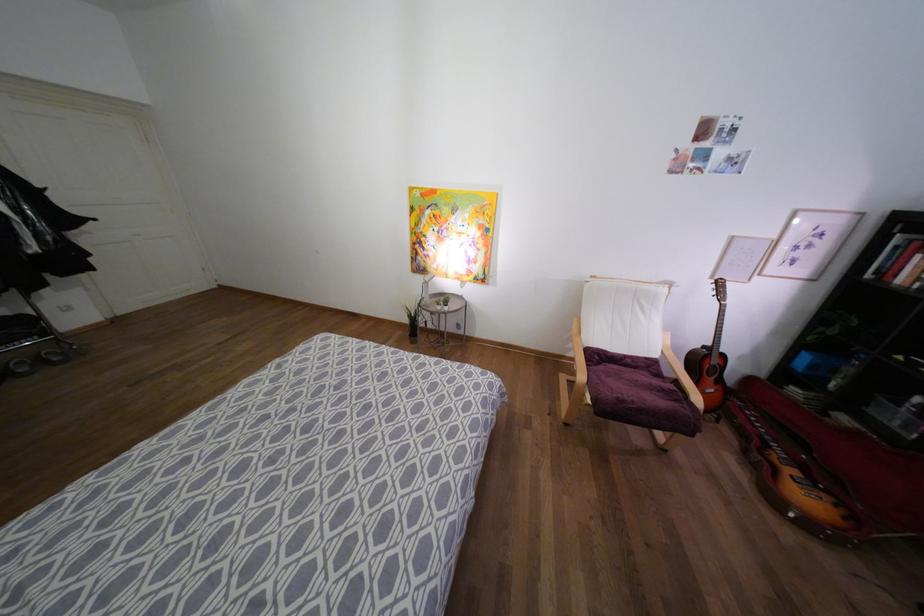
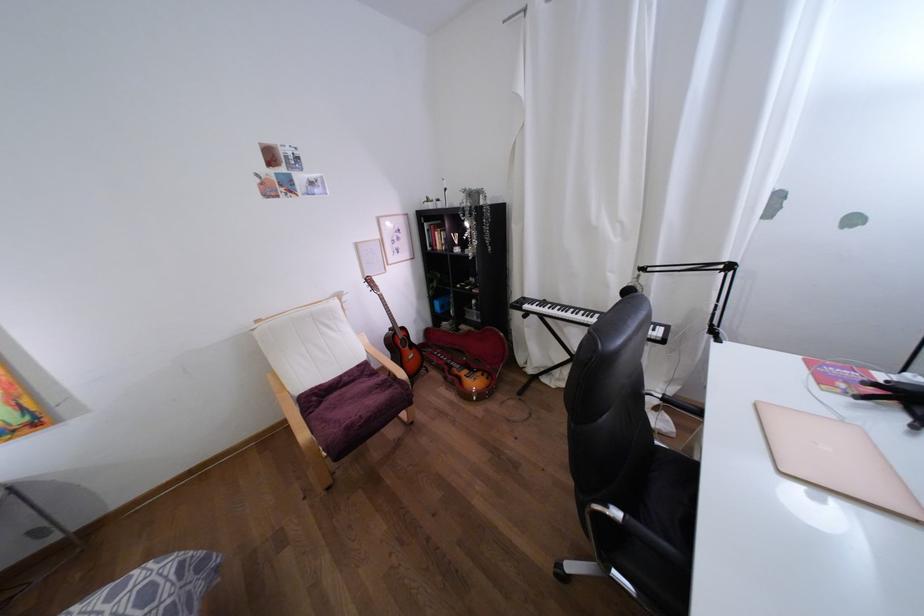
Question: Based on the continuous images, in which direction is the camera rotating? Reply with the corresponding letter.

Choices:
 (A) Left
 (B) Right
 (C) Up
 (D) Down

Answer: (B)